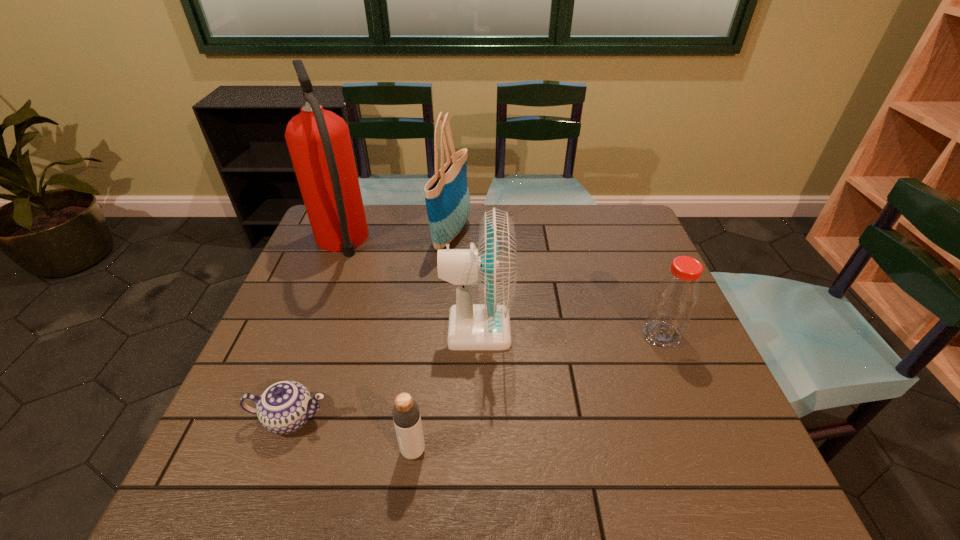
At what (x,y) coordinates should I click in order to perform the action: click on vacant region located 0.210m on the back of the right bottle. Please return your answer as a coordinate pair (x, y). This screenshot has height=540, width=960. Looking at the image, I should click on (634, 268).

Where is `free space located on the back of the nearer bottle`? This screenshot has height=540, width=960. free space located on the back of the nearer bottle is located at coordinates (422, 373).

Identify the location of vacant space located at the spout of the chinaware. (457, 418).

This screenshot has width=960, height=540. I want to click on fire extinguisher that is at the far edge, so click(319, 143).

Locate an element on the screen. Image resolution: width=960 pixels, height=540 pixels. tote bag present at the far edge is located at coordinates (447, 197).

Identify the location of object situated at the near edge. This screenshot has width=960, height=540. (406, 416).

Find the location of a particular element. fire extinguisher located in the left edge section of the desktop is located at coordinates (319, 143).

What are the coordinates of `chinaware that is positioned at the left edge` in the screenshot? It's located at (284, 407).

Where is `object located in the right edge section of the desktop`? Image resolution: width=960 pixels, height=540 pixels. object located in the right edge section of the desktop is located at coordinates [676, 295].

This screenshot has width=960, height=540. I want to click on object that is at the far left corner, so click(319, 143).